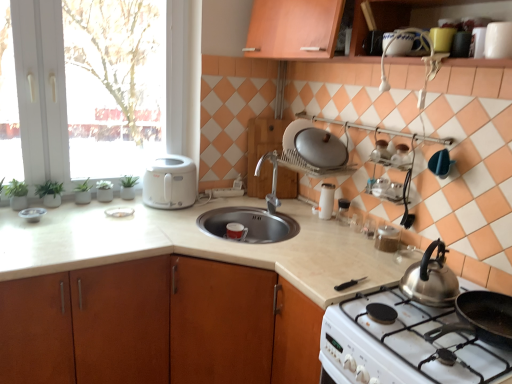
The image size is (512, 384). Identify the location of vacant space to the right of green matte plant at left. (82, 205).